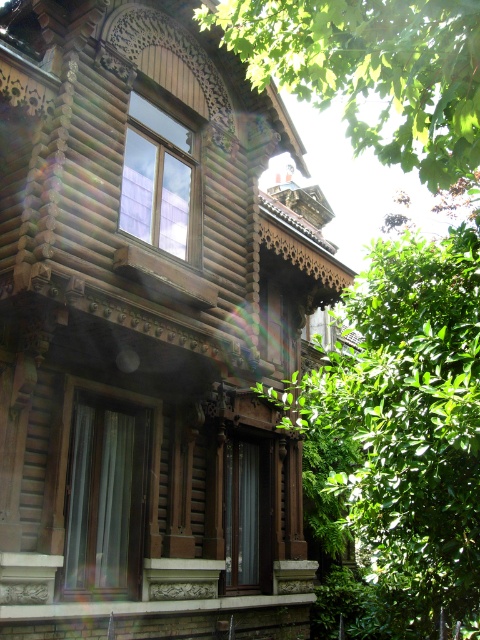
Is point (478, 150) closer to viewer compared to point (148, 106)?

Yes, it is.

Who is higher up, green leafy tree at upper center or transparent glass window at upper center?

transparent glass window at upper center is above.

Locate an element on the screen. The width and height of the screenshot is (480, 640). green leafy tree at upper center is located at coordinates (372, 70).

Between green leafy tree at upper center and matte wooden window at center, which one appears on the left side from the viewer's perspective?

From the viewer's perspective, matte wooden window at center appears more on the left side.

This screenshot has width=480, height=640. What are the coordinates of `green leafy tree at upper center` in the screenshot? It's located at (372, 70).

Who is more distant from viewer, (384, 563) or (178, 227)?

Point (178, 227)

Identify the location of green leafy tree at center. The height and width of the screenshot is (640, 480). (398, 442).

Locate an element on the screen. The width and height of the screenshot is (480, 640). green leafy tree at center is located at coordinates (398, 442).